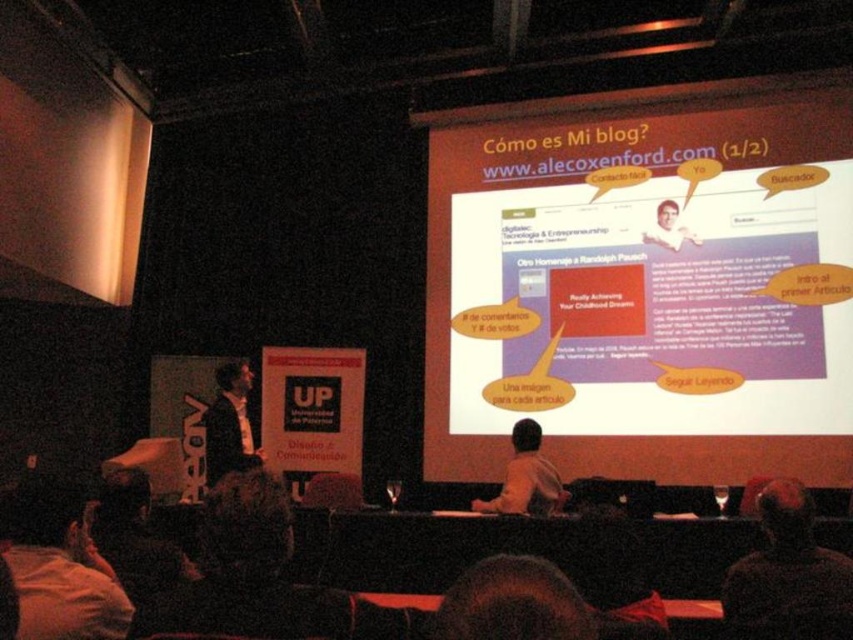
Is point (785, 572) behind point (480, 499)?

No, (785, 572) is in front of (480, 499).

How much distance is there between dark brown leather jacket at lower right and light brown shirt at center?

dark brown leather jacket at lower right is 5.36 feet away from light brown shirt at center.

Is point (798, 593) farther from camera compared to point (515, 490)?

No.

Locate an element on the screen. The image size is (853, 640). dark brown leather jacket at lower right is located at coordinates click(x=787, y=576).

Does white glossy projection screen at upper center have a larger size compared to light brown shirt at center?

Correct, white glossy projection screen at upper center is larger in size than light brown shirt at center.

Between white glossy projection screen at upper center and light brown shirt at center, which one has more height?

With more height is white glossy projection screen at upper center.

At what (x,y) coordinates should I click in order to perform the action: click on white glossy projection screen at upper center. Please return your answer as a coordinate pair (x, y). The height and width of the screenshot is (640, 853). Looking at the image, I should click on click(x=643, y=291).

The image size is (853, 640). Identify the location of white glossy projection screen at upper center. (643, 291).

Is dark fabric pillow at lower left wider than dark brown leather jacket at lower right?

Indeed, dark fabric pillow at lower left has a greater width compared to dark brown leather jacket at lower right.

Does dark fabric pillow at lower left have a smaller size compared to dark brown leather jacket at lower right?

Incorrect, dark fabric pillow at lower left is not smaller in size than dark brown leather jacket at lower right.

Is point (53, 577) positioned in front of point (813, 634)?

That is True.

Where is `dark fabric pillow at lower left`? dark fabric pillow at lower left is located at coordinates (59, 564).